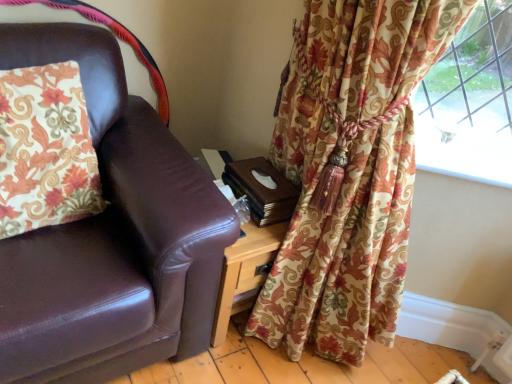
Describe the element at coordinates (45, 150) in the screenshot. The width and height of the screenshot is (512, 384). I see `floral fabric pillow at left` at that location.

This screenshot has height=384, width=512. I want to click on floral fabric pillow at left, so click(x=45, y=150).

Locate an element on the screen. The image size is (512, 384). floral fabric curtain at right is located at coordinates (349, 171).

What do you see at coordinates (349, 171) in the screenshot?
I see `floral fabric curtain at right` at bounding box center [349, 171].

You are a GUI agent. You are given a task and a screenshot of the screen. Output one action in this format:
    pyautogui.click(x=<x>, y=<y>)
    Task: Click on the floral fabric pillow at left
    This screenshot has height=384, width=512.
    Given the screenshot: What is the action you would take?
    pyautogui.click(x=45, y=150)

Is floral fabric pillow at left to the left or to the right of floral fabric curtain at right in the image?

In the image, floral fabric pillow at left appears on the left side of floral fabric curtain at right.

Which object is closer to the camera taking this photo, floral fabric pillow at left or floral fabric curtain at right?

floral fabric curtain at right is in front.

Is point (74, 153) behind point (384, 34)?

Yes, it is behind point (384, 34).

From the image's perspective, which one is positioned lower, floral fabric pillow at left or floral fabric curtain at right?

floral fabric curtain at right appears lower in the image.

From a real-world perspective, which object stands above the other?

floral fabric pillow at left, from a real-world perspective.

Consider the image. Is floral fabric pillow at left thinner than floral fabric curtain at right?

Yes, floral fabric pillow at left is thinner than floral fabric curtain at right.

Does floral fabric pillow at left have a lesser height compared to floral fabric curtain at right?

Correct, floral fabric pillow at left is not as tall as floral fabric curtain at right.

Can you confirm if floral fabric pillow at left is bigger than floral fabric curtain at right?

No, floral fabric pillow at left is not bigger than floral fabric curtain at right.

Is floral fabric pillow at left not within floral fabric curtain at right?

floral fabric pillow at left lies outside floral fabric curtain at right's area.

Consider the image. Is floral fabric pillow at left not close to floral fabric curtain at right?

Actually, floral fabric pillow at left and floral fabric curtain at right are a little close together.

Could you tell me if floral fabric pillow at left is facing floral fabric curtain at right?

No, floral fabric pillow at left does not turn towards floral fabric curtain at right.

How many degrees apart are the facing directions of floral fabric pillow at left and floral fabric curtain at right?

60.7 degrees separate the facing orientations of floral fabric pillow at left and floral fabric curtain at right.

Find the location of a particular element. The image size is (512, 384). pillow above the floral fabric curtain at right (from a real-world perspective) is located at coordinates (45, 150).

Is floral fabric curtain at right to the left or to the right of floral fabric pillow at left in the image?

Clearly, floral fabric curtain at right is on the right of floral fabric pillow at left in the image.

Considering the relative positions of floral fabric curtain at right and floral fabric pillow at left in the image provided, is floral fabric curtain at right in front of floral fabric pillow at left?

Yes, the depth of floral fabric curtain at right is less than that of floral fabric pillow at left.

Considering the points (368, 33) and (22, 98), which point is in front, point (368, 33) or point (22, 98)?

Positioned in front is point (368, 33).

From the image's perspective, is floral fabric curtain at right located above or below floral fabric pillow at left?

floral fabric curtain at right is situated lower than floral fabric pillow at left in the image.

From a real-world perspective, which object stands above the other?

floral fabric pillow at left, from a real-world perspective.

Which object is thinner, floral fabric curtain at right or floral fabric pillow at left?

Thinner between the two is floral fabric pillow at left.

Consider the image. Does floral fabric curtain at right have a greater height compared to floral fabric pillow at left?

Yes.

Is floral fabric curtain at right bigger than floral fabric pillow at left?

Correct, floral fabric curtain at right is larger in size than floral fabric pillow at left.

Do you think floral fabric curtain at right is within floral fabric pillow at left, or outside of it?

floral fabric curtain at right lies outside floral fabric pillow at left.

Is floral fabric curtain at right not near floral fabric pillow at left?

No, floral fabric curtain at right is in close proximity to floral fabric pillow at left.

Is floral fabric curtain at right looking in the opposite direction of floral fabric pillow at left?

No, floral fabric curtain at right is not facing away from floral fabric pillow at left.

Where is `curtain located below the floral fabric pillow at left (from the image's perspective)`? curtain located below the floral fabric pillow at left (from the image's perspective) is located at coordinates (349, 171).

Find the location of `pillow located above the floral fabric curtain at right (from the image's perspective)`. pillow located above the floral fabric curtain at right (from the image's perspective) is located at coordinates (45, 150).

Where is `curtain lying below the floral fabric pillow at left (from the image's perspective)`? The height and width of the screenshot is (384, 512). curtain lying below the floral fabric pillow at left (from the image's perspective) is located at coordinates (349, 171).